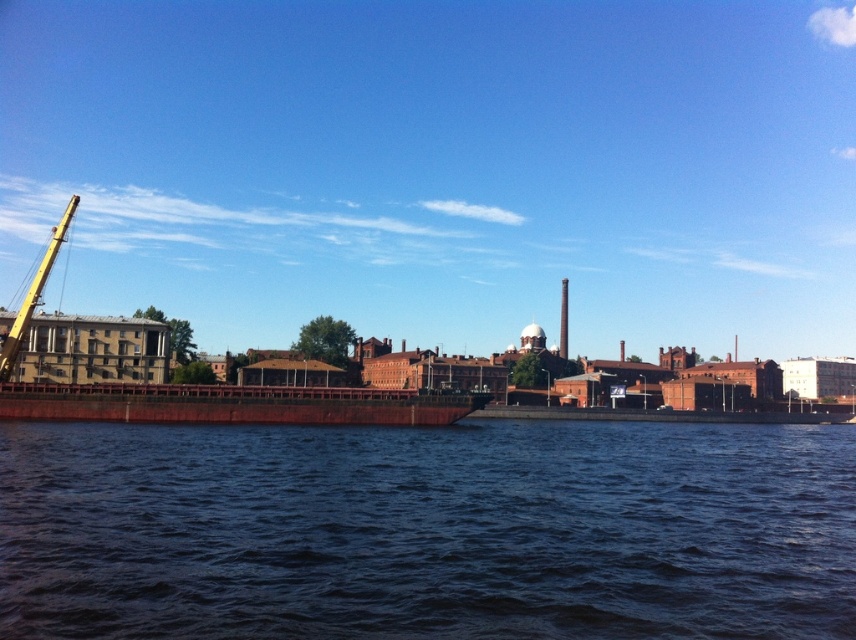
You are a delivery driver who needs to transport a 3m tall container to the waterfront. The container must be placed on the rustic metal barge at center. However, there is a yellow metallic crane at left nearby. Considering their heights, will the container fit on the barge without hitting the crane?

The rustic metal barge at center is not as tall as the yellow metallic crane at left. Since the container is 3m tall, it can be placed on the barge as long as the crane is not obstructing the path. However, the crane might need to be lowered or moved to avoid collision during loading.